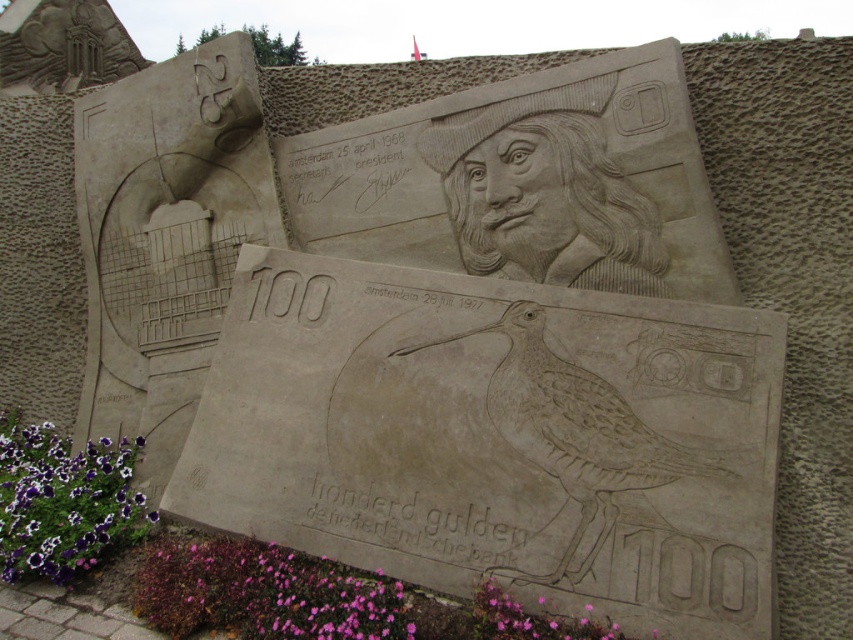
You are a gardener who needs to plant a new flower between the purple matte flower at lower center and the purple petal at lower left. The recommended spacing between plants is 1 meter. Is there enough space to plant the new flower without violating the spacing rule?

The purple matte flower at lower center and the purple petal at lower left are 1.09 meters apart from each other. Since the recommended spacing is 1 meter, there is enough space to plant the new flower between them without violating the rule.

You are an art conservator assessing the spacing between the purple petal at lower left and the pink matte flower at lower center in the sand sculpture. Given that the recommended minimum distance for preservation is 10 feet between such elements, is the current spacing sufficient?

The purple petal at lower left is 9.56 feet from the pink matte flower at lower center, which is below the recommended 10 feet minimum distance for preservation. The spacing is insufficient.

Please look at the sand sculpture. There is a point labeled as point (64,500). Can you tell me what this point corresponds to in the sand sculpture?

The point (64,500) corresponds to the purple petal at lower left.